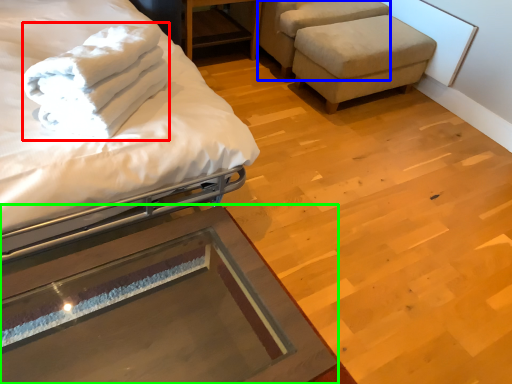
Question: Which object is positioned farthest from bath towel (highlighted by a red box)? Select from swivel chair (highlighted by a blue box) and table (highlighted by a green box).

Choices:
 (A) swivel chair
 (B) table

Answer: (A)